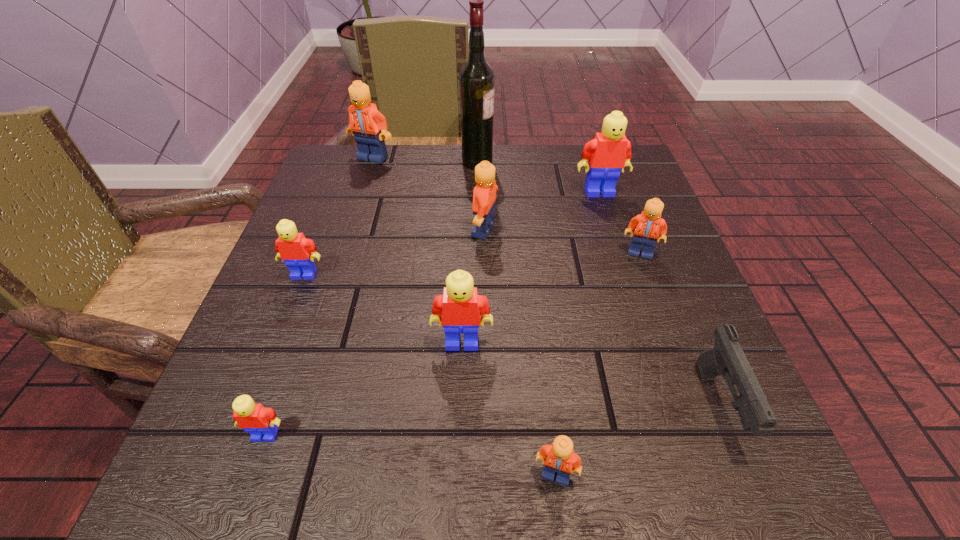
Choose which Lego is the sixth nearest neighbor to the pistol. Please provide its 2D coordinates. Your answer should be formatted as a tuple, i.e. [(x, y)], where the tuple contains the x and y coordinates of a point satisfying the conditions above.

[(254, 418)]

Where is `Lego that can be found as the third closest to the leftmost orange Lego`? This screenshot has width=960, height=540. Lego that can be found as the third closest to the leftmost orange Lego is located at coordinates (609, 152).

Identify which orange Lego is the second closest to the farthest Lego. Please provide its 2D coordinates. Your answer should be formatted as a tuple, i.e. [(x, y)], where the tuple contains the x and y coordinates of a point satisfying the conditions above.

[(647, 225)]

Identify which orange Lego is the fourth closest to the fourth nearest object. Please provide its 2D coordinates. Your answer should be formatted as a tuple, i.e. [(x, y)], where the tuple contains the x and y coordinates of a point satisfying the conditions above.

[(369, 127)]

Find the location of a particular element. yellow Lego object that ranks as the closest to the third nearest Lego is located at coordinates (254, 418).

Point out which yellow Lego is positioned as the second nearest to the seventh farthest object. Please provide its 2D coordinates. Your answer should be formatted as a tuple, i.e. [(x, y)], where the tuple contains the x and y coordinates of a point satisfying the conditions above.

[(298, 252)]

Find the location of a particular element. free space that satisfies the following two spatial constraints: 1. on the front-facing side of the second biggest orange Lego; 2. on the front-facing side of the nearest yellow Lego is located at coordinates (487, 434).

Find the location of a particular element. This screenshot has width=960, height=540. free space that satisfies the following two spatial constraints: 1. on the front and back of the wine bottle; 2. on the front-facing side of the nearest yellow Lego is located at coordinates (475, 434).